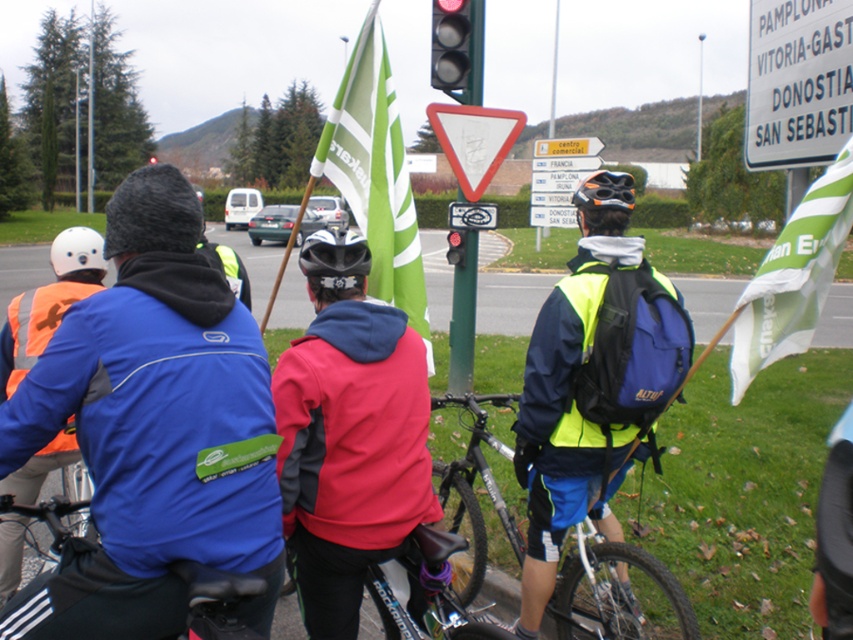
Question: Estimate the real-world distances between objects in this image. Which object is farther from the high visibility jacket at center?

Choices:
 (A) white matte helmet at upper left
 (B) red matte traffic light at center
 (C) brushed metal speed bump at center

Answer: (B)

Question: Estimate the real-world distances between objects in this image. Which object is farther from the black matte helmet at center?

Choices:
 (A) white plastic sign at upper right
 (B) green fabric flag at center

Answer: (A)

Question: Is red fabric jacket at center thinner than black matte helmet at center?

Choices:
 (A) no
 (B) yes

Answer: (A)

Question: Is green fabric flag at center positioned behind white plastic road sign at upper center?

Choices:
 (A) yes
 (B) no

Answer: (B)

Question: Does high visibility jacket at center have a larger size compared to green fabric flag at center?

Choices:
 (A) yes
 (B) no

Answer: (B)

Question: Which of the following is the closest to the observer?

Choices:
 (A) black matte bicycle helmet at center
 (B) white plastic sign at upper right
 (C) white matte helmet at upper left
 (D) red fabric jacket at center

Answer: (D)